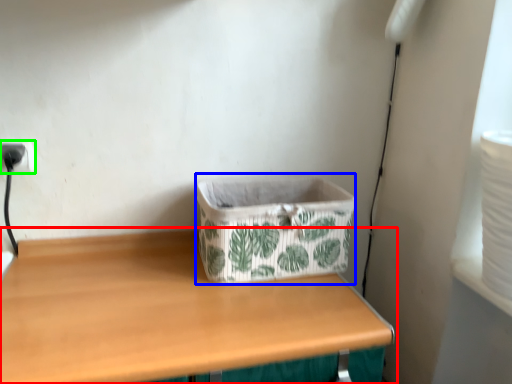
Question: Which is farther away from table (highlighted by a red box)? storage box (highlighted by a blue box) or electric outlet (highlighted by a green box)?

Choices:
 (A) storage box
 (B) electric outlet

Answer: (B)